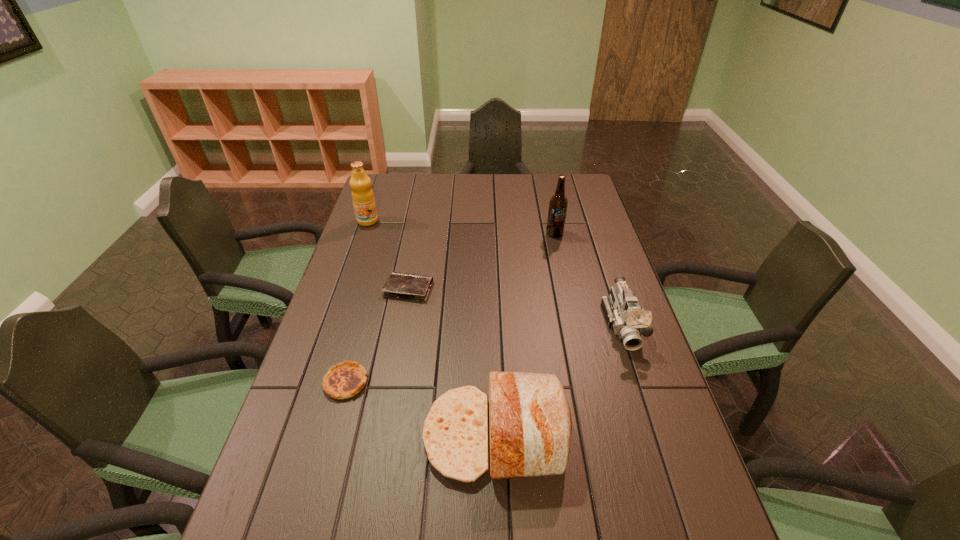
This screenshot has width=960, height=540. I want to click on the farthest object, so click(x=363, y=198).

Locate an element on the screen. This screenshot has height=540, width=960. the fifth nearest object is located at coordinates (558, 203).

Identify the location of the second object from right to left. (558, 203).

Where is `the fourth object from left to right`? This screenshot has width=960, height=540. the fourth object from left to right is located at coordinates (530, 424).

Locate an element on the screen. The height and width of the screenshot is (540, 960). camcorder is located at coordinates (622, 310).

I want to click on diary, so click(413, 287).

What are the coordinates of `quiche` in the screenshot? It's located at (344, 380).

Image resolution: width=960 pixels, height=540 pixels. I want to click on vacant area located on the front label of the fruit juice, so click(x=347, y=284).

The image size is (960, 540). In order to click on free location located 0.180m on the label of the fifth object from left to right in this screenshot , I will do `click(563, 271)`.

At what (x,y) coordinates should I click in order to perform the action: click on free spot located at the sliced end of the fourth object from left to right. Please return your answer as a coordinate pair (x, y). The image size is (960, 540). Looking at the image, I should click on [x=372, y=435].